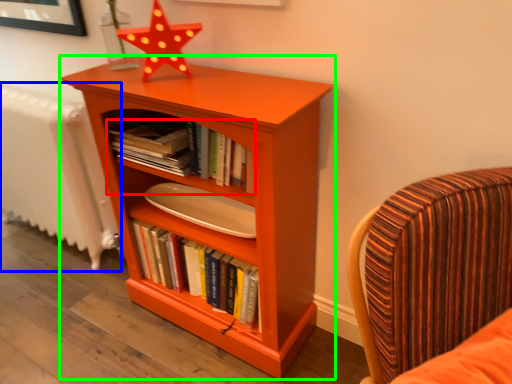
Question: Which object is the farthest from book (highlighted by a red box)? Choose among these: radiator (highlighted by a blue box) or bookcase (highlighted by a green box).

Choices:
 (A) radiator
 (B) bookcase

Answer: (A)